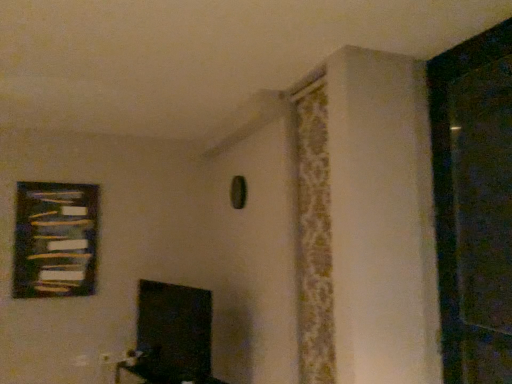
Question: Based on their sizes in the image, would you say wooden frame at upper left is bigger or smaller than matte black tv at lower center?

Choices:
 (A) small
 (B) big

Answer: (A)

Question: Considering the relative positions of wooden frame at upper left and matte black tv at lower center in the image provided, is wooden frame at upper left to the left or to the right of matte black tv at lower center?

Choices:
 (A) right
 (B) left

Answer: (B)

Question: Considering the real-world distances, which object is farthest from the matte black tv at lower center?

Choices:
 (A) black matte screen door at right
 (B) wooden frame at upper left
 (C) patterned fabric curtain at upper right

Answer: (A)

Question: Which object is positioned farthest from the matte black tv at lower center?

Choices:
 (A) black matte screen door at right
 (B) wooden frame at upper left
 (C) patterned fabric curtain at upper right

Answer: (A)